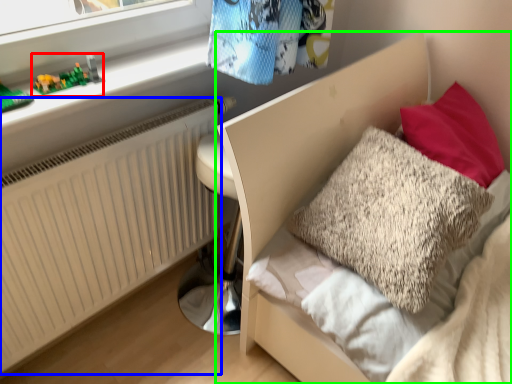
Question: Which is farther away from toy (highlighted by a red box)? radiator (highlighted by a blue box) or bed (highlighted by a green box)?

Choices:
 (A) radiator
 (B) bed

Answer: (B)